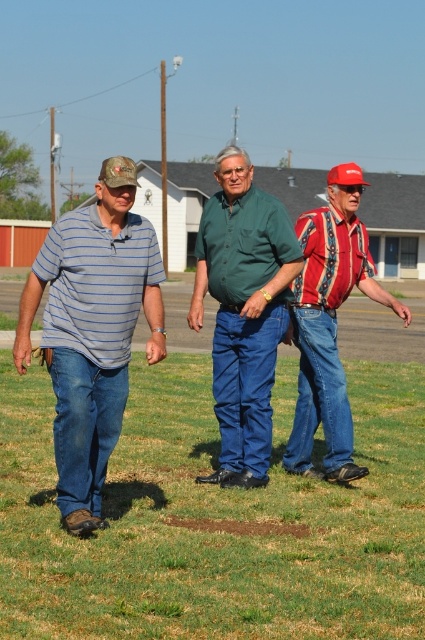
Where is the striped cotton shirt at left located in the image?

The striped cotton shirt at left is located at point (93, 330) in the image.

You are a photographer trying to capture a candid shot of the striped cotton shirt at left and the red plaid shirt at center. Which shirt should you focus on first to ensure both are in the frame?

The striped cotton shirt at left is in front of the red plaid shirt at center, so focus on the striped cotton shirt at left first to ensure both are visible in the frame.